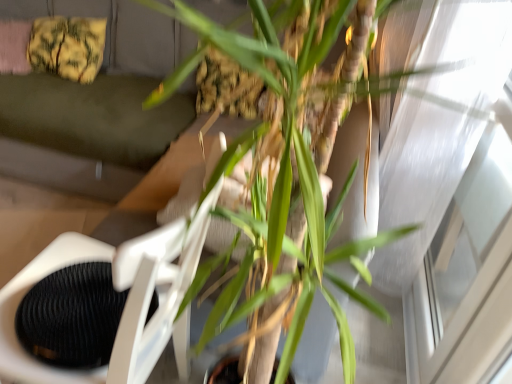
Question: From a real-world perspective, is green fabric couch at upper center above or below transparent glass window at upper right?

Choices:
 (A) below
 (B) above

Answer: (A)

Question: Looking at their shapes, would you say green fabric couch at upper center is wider or thinner than transparent glass window at upper right?

Choices:
 (A) wide
 (B) thin

Answer: (A)

Question: Estimate the real-world distances between objects in this image. Which object is closer to the yellow fabric pillow at upper left?

Choices:
 (A) white plastic swivel chair at center
 (B) green leafy plant at center
 (C) transparent glass window at upper right
 (D) green fabric couch at upper center

Answer: (D)

Question: Considering the real-world distances, which object is closest to the green leafy plant at center?

Choices:
 (A) green fabric couch at upper center
 (B) transparent glass window at upper right
 (C) white plastic swivel chair at center
 (D) yellow fabric pillow at upper left

Answer: (C)